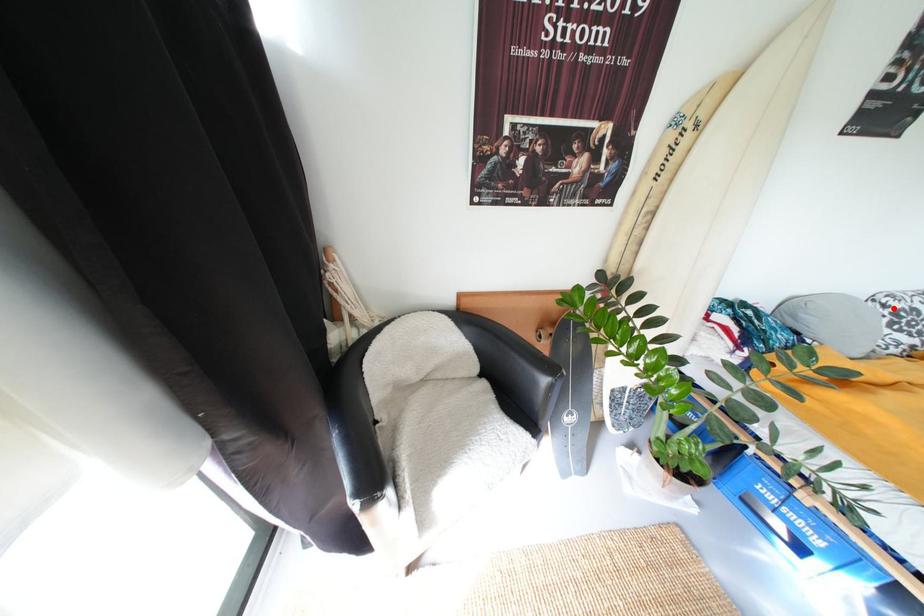
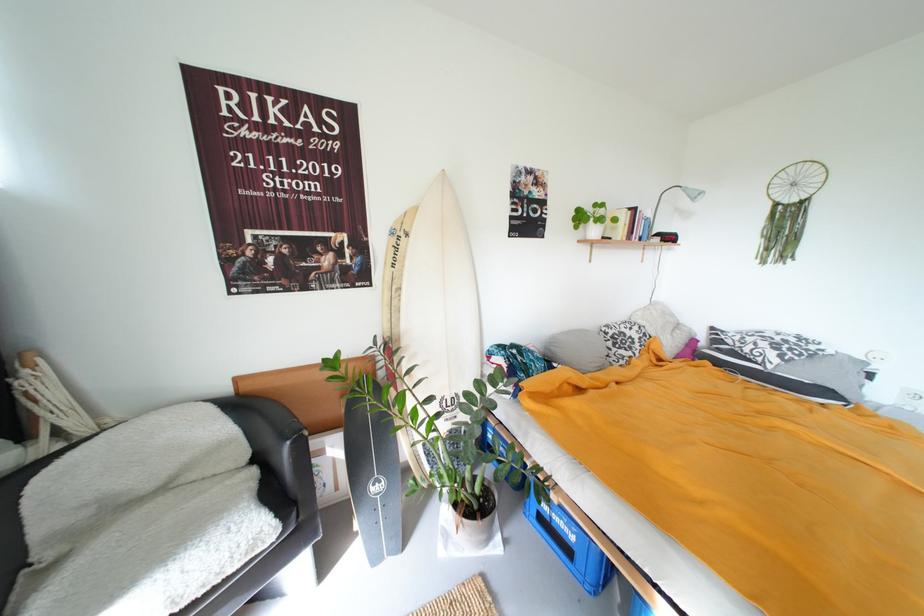
Question: I am providing you with two images of the same scene from different viewpoints. Image1 has a red point marked. In image2, the corresponding 3D location appears at what relative position? Reply with the corresponding letter.

Choices:
 (A) Closer
 (B) Farther

Answer: (A)